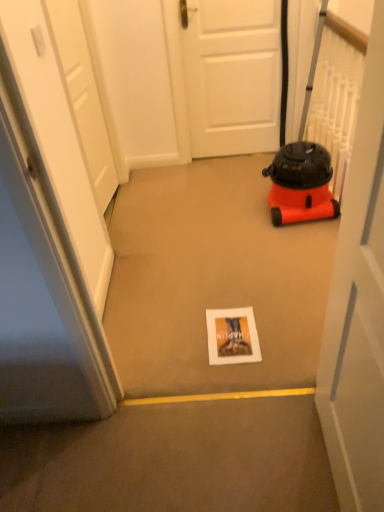
Find the location of `vacant space underneath white matte door at center, the first door in the back-to-front sequence (from a real-world perspective)`. vacant space underneath white matte door at center, the first door in the back-to-front sequence (from a real-world perspective) is located at coordinates (217, 153).